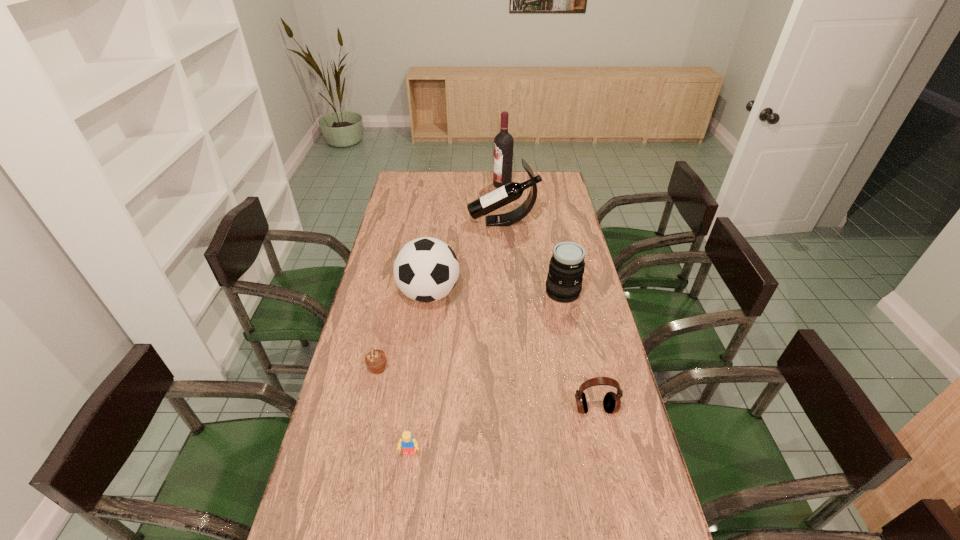
At what (x,y) coordinates should I click in order to perform the action: click on the farther wine bottle. Please return your answer as a coordinate pair (x, y). The image size is (960, 540). Looking at the image, I should click on (503, 143).

I want to click on the taller wine bottle, so click(503, 143).

Where is `the second tallest object`? the second tallest object is located at coordinates [512, 191].

This screenshot has width=960, height=540. What are the coordinates of `the second farthest object` in the screenshot? It's located at (512, 191).

Where is `the third tallest object`? the third tallest object is located at coordinates (426, 269).

The width and height of the screenshot is (960, 540). I want to click on telephoto lens, so click(x=564, y=280).

Locate an element on the screen. This screenshot has width=960, height=540. the fifth tallest object is located at coordinates (612, 402).

Image resolution: width=960 pixels, height=540 pixels. I want to click on the sixth farthest object, so click(x=612, y=402).

Where is `the fifth farthest object`? Image resolution: width=960 pixels, height=540 pixels. the fifth farthest object is located at coordinates (375, 360).

Where is `Lego`? This screenshot has height=540, width=960. Lego is located at coordinates (408, 444).